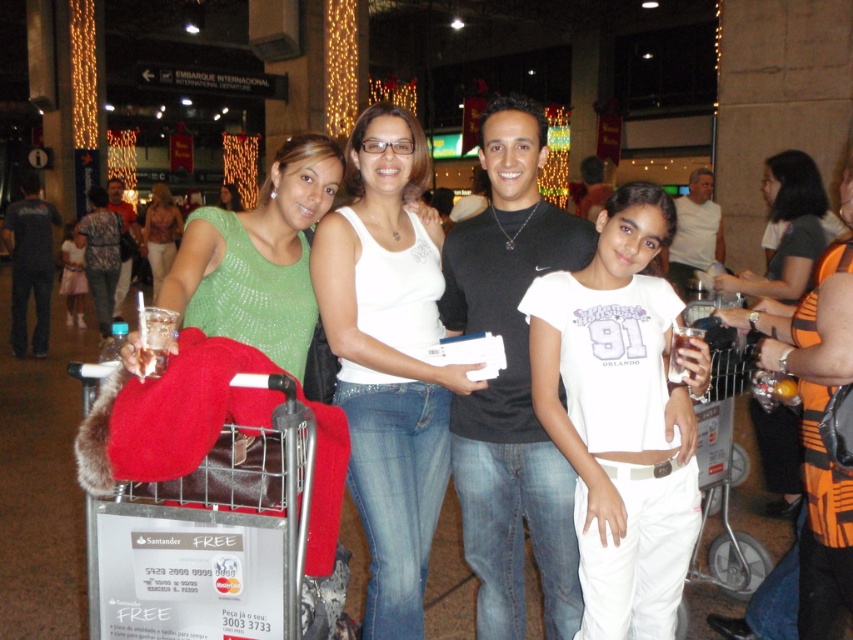
Who is taller, white cotton shirt at center or orange striped tank top at center?

Standing taller between the two is white cotton shirt at center.

Can you confirm if white cotton shirt at center is positioned to the right of orange striped tank top at center?

No, white cotton shirt at center is not to the right of orange striped tank top at center.

Identify the location of white cotton shirt at center. The image size is (853, 640). (619, 417).

Does white cotton shirt at center have a lesser width compared to green knit sweater at center?

No, white cotton shirt at center is not thinner than green knit sweater at center.

Image resolution: width=853 pixels, height=640 pixels. What do you see at coordinates (619, 417) in the screenshot?
I see `white cotton shirt at center` at bounding box center [619, 417].

Image resolution: width=853 pixels, height=640 pixels. I want to click on white cotton shirt at center, so click(619, 417).

Is point (421, 612) less distant than point (163, 262)?

Yes, point (421, 612) is in front of point (163, 262).

Which is behind, point (416, 160) or point (160, 244)?

The point (160, 244) is more distant.

Does point (315, 252) lie behind point (143, 227)?

No, (315, 252) is in front of (143, 227).

In order to click on white denim jeans at center in this screenshot , I will do `click(389, 356)`.